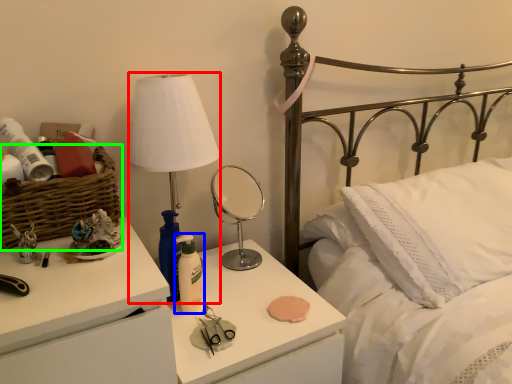
Question: Which object is the farthest from table lamp (highlighted by a red box)? Choose among these: bottle (highlighted by a blue box) or basket (highlighted by a green box).

Choices:
 (A) bottle
 (B) basket

Answer: (A)